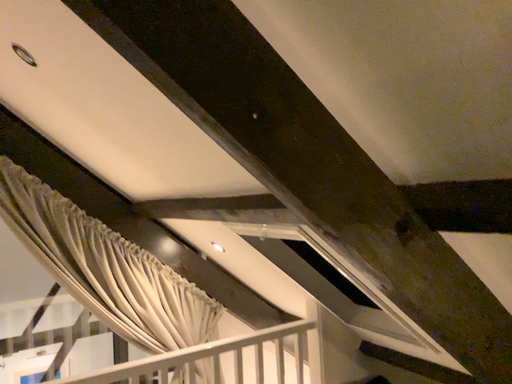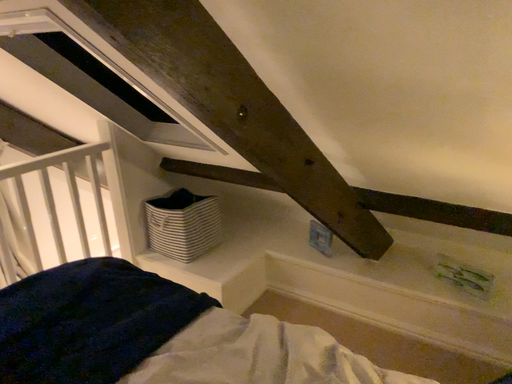
Question: How did the camera likely rotate when shooting the video?

Choices:
 (A) rotated downward
 (B) rotated upward

Answer: (A)